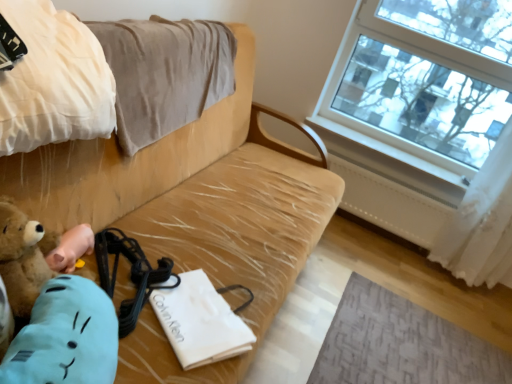
Image resolution: width=512 pixels, height=384 pixels. I want to click on free space that is to the left of white sheer curtain at right, so click(x=400, y=263).